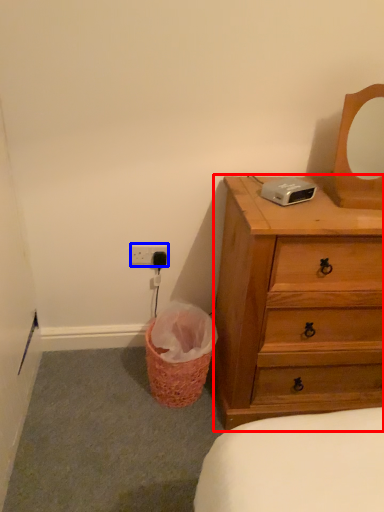
Question: Which point is further to the camera, chest of drawers (highlighted by a red box) or electric outlet (highlighted by a blue box)?

Choices:
 (A) chest of drawers
 (B) electric outlet

Answer: (B)